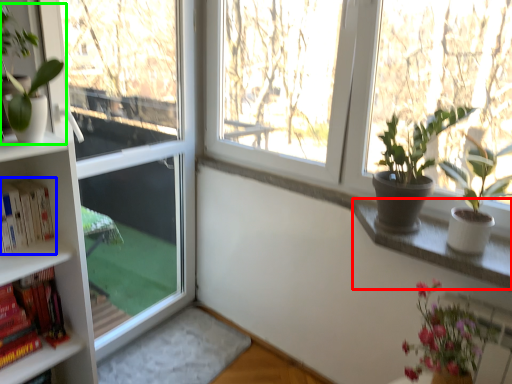
Question: Estimate the real-world distances between objects in this image. Which object is closer to window sill (highlighted by a red box), book (highlighted by a blue box) or houseplant (highlighted by a green box)?

Choices:
 (A) book
 (B) houseplant

Answer: (A)